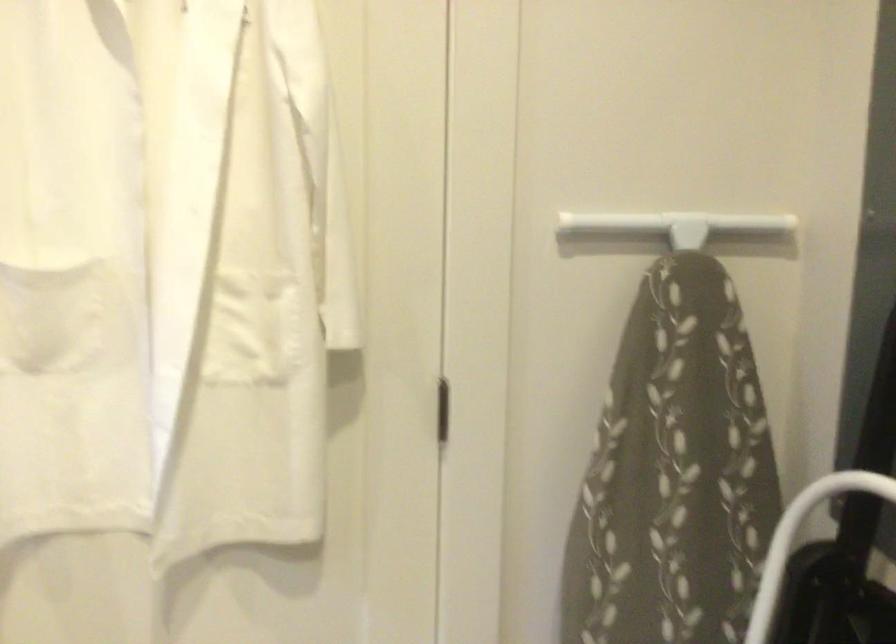
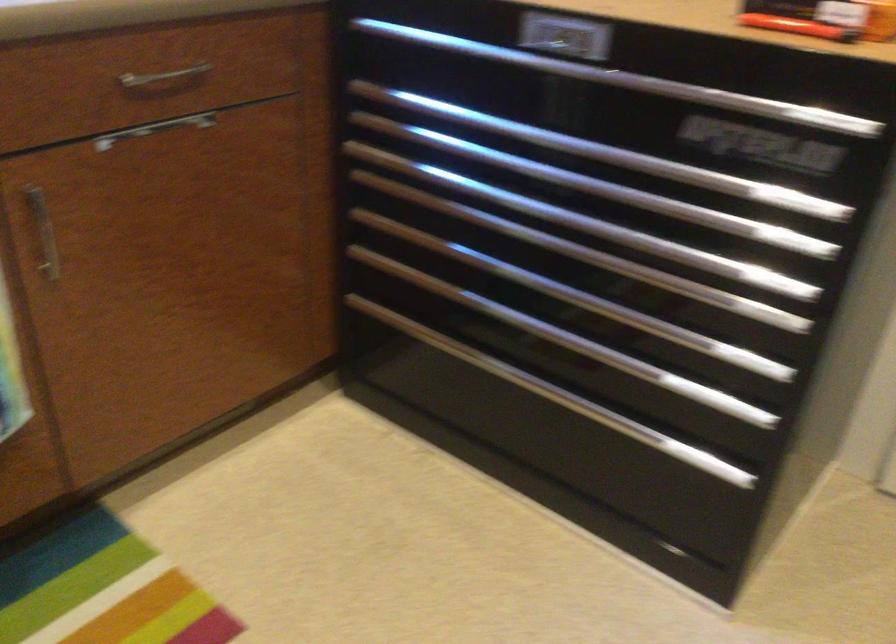
Looking at this image, how did the camera likely rotate?

The camera's rotation is toward left-down.